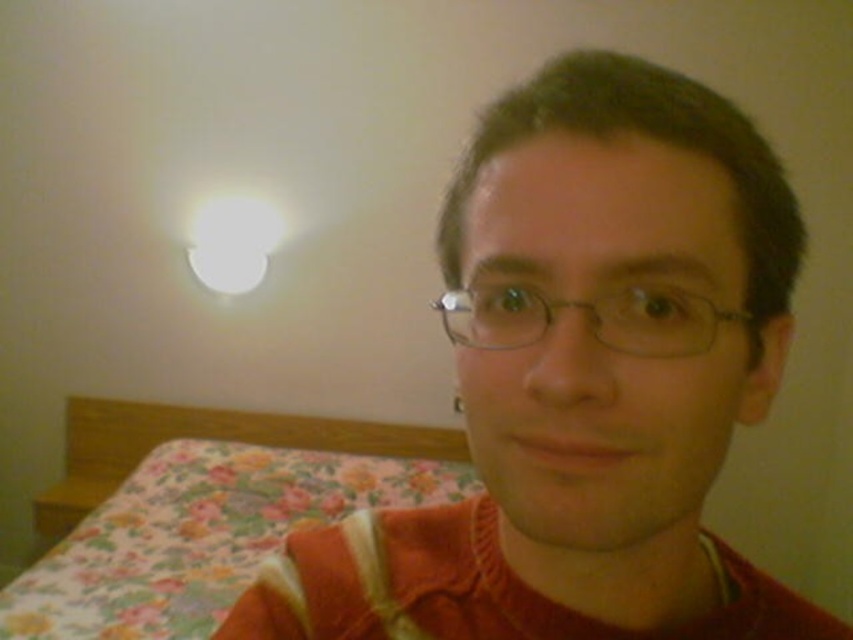
You are a photographer adjusting lighting for a portrait. You notice the orange fabric at center and the metallic wireframe glasses at center. Which object is closer to the camera lens?

The orange fabric at center is closer to the camera lens because it is in front of the metallic wireframe glasses at center.